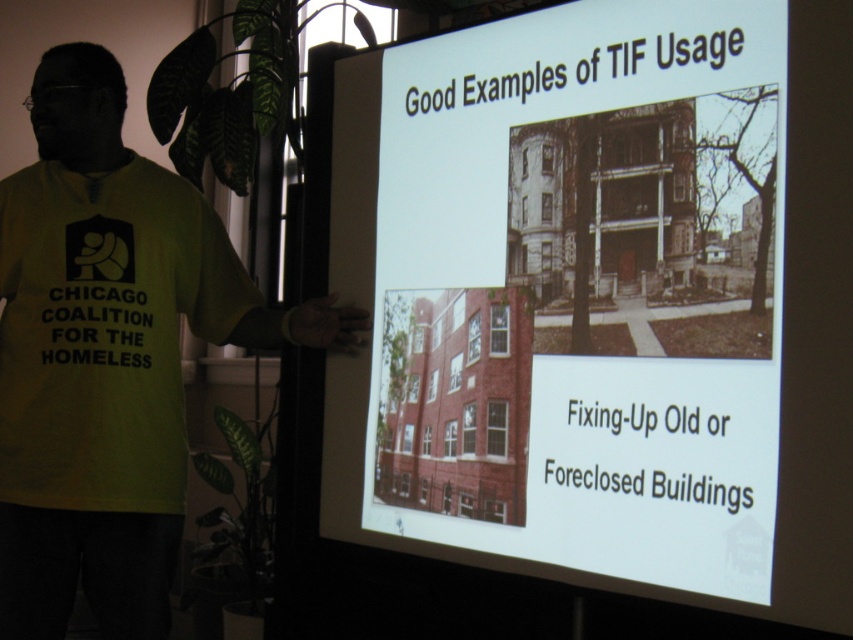
Question: Does matte brick building at center lie in front of yellow cotton t-shirt at left?

Choices:
 (A) yes
 (B) no

Answer: (A)

Question: Which is nearer to the yellow cotton t-shirt at left?

Choices:
 (A) yellow t-shirt at left
 (B) matte brick building at center

Answer: (A)

Question: Is matte brick building at center behind yellow cotton t-shirt at left?

Choices:
 (A) yes
 (B) no

Answer: (B)

Question: Which object is the closest to the matte brick building at center?

Choices:
 (A) yellow t-shirt at left
 (B) yellow cotton t-shirt at left

Answer: (A)

Question: Which object appears farthest from the camera in this image?

Choices:
 (A) matte brick building at center
 (B) yellow t-shirt at left

Answer: (B)

Question: Does matte brick building at center come in front of yellow t-shirt at left?

Choices:
 (A) no
 (B) yes

Answer: (B)